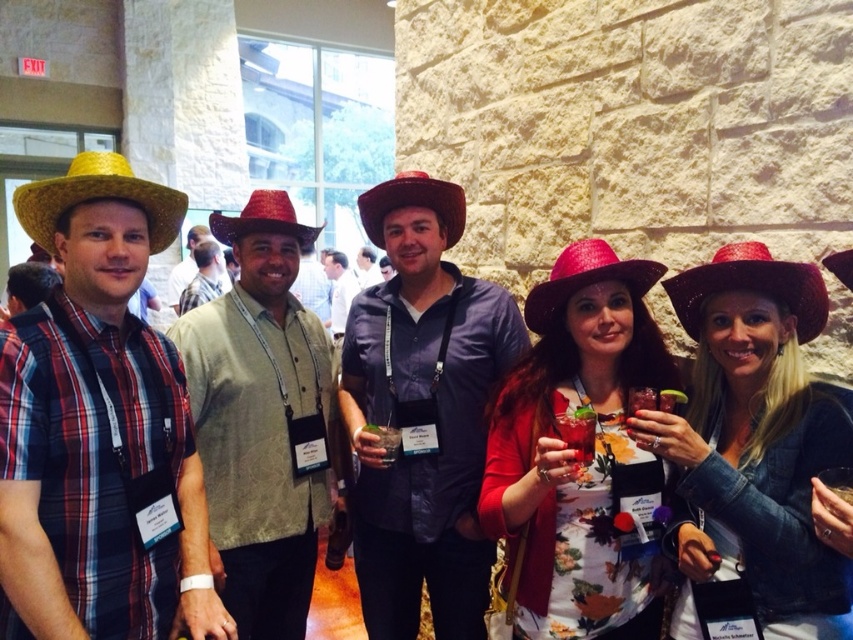
Question: Does matte brown cowboy hat at center have a smaller size compared to sparkly red cowboy hat at center?

Choices:
 (A) no
 (B) yes

Answer: (A)

Question: Is matte brown cowboy hat at center positioned in front of sparkly red cowboy hat at center?

Choices:
 (A) yes
 (B) no

Answer: (A)

Question: Can you confirm if sparkly red cowboy hat at right is wider than matte brown cowboy hat at center?

Choices:
 (A) no
 (B) yes

Answer: (A)

Question: Which point is closer to the camera?

Choices:
 (A) pink straw cowboy hat at center
 (B) sparkly red cowboy hat at center

Answer: (A)

Question: Which of the following is the farthest from the observer?

Choices:
 (A) (444, 208)
 (B) (761, 262)

Answer: (A)

Question: Which is nearer to the yellow straw cowboy hat at left?

Choices:
 (A) matte brown cowboy hat at center
 (B) sparkly red cowboy hat at right
 (C) sparkly red cowboy hat at center

Answer: (C)